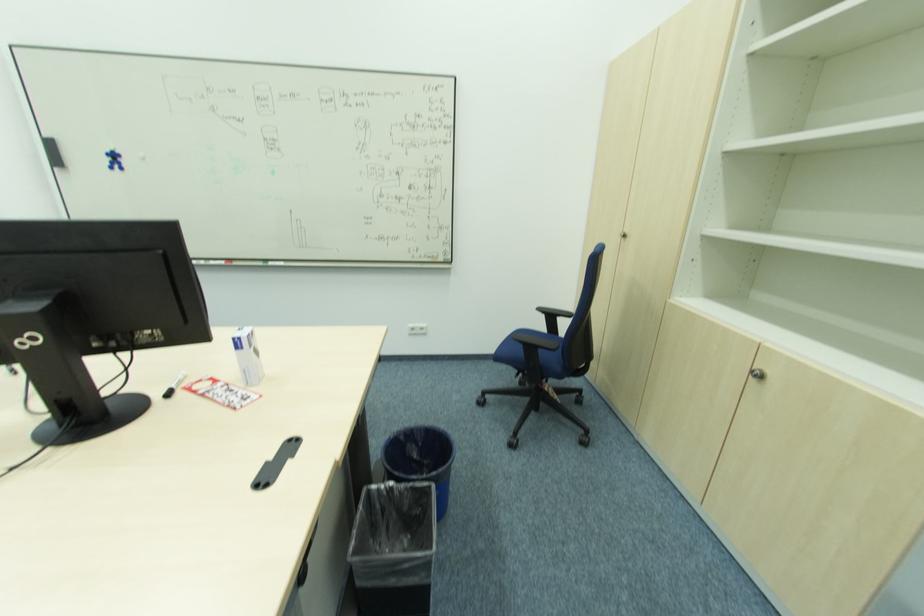
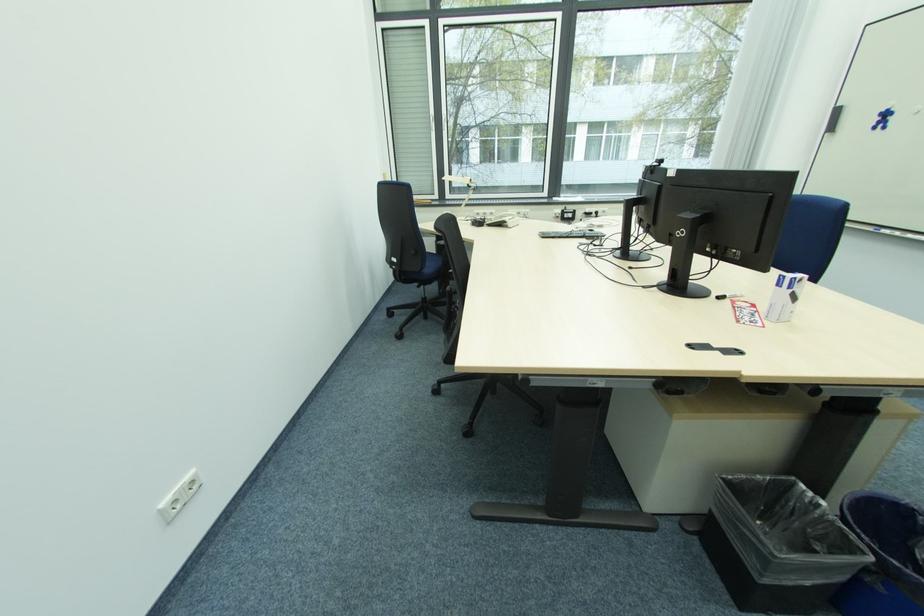
Where in the second image is the point corresponding to (x=247, y=350) from the first image?

(784, 288)